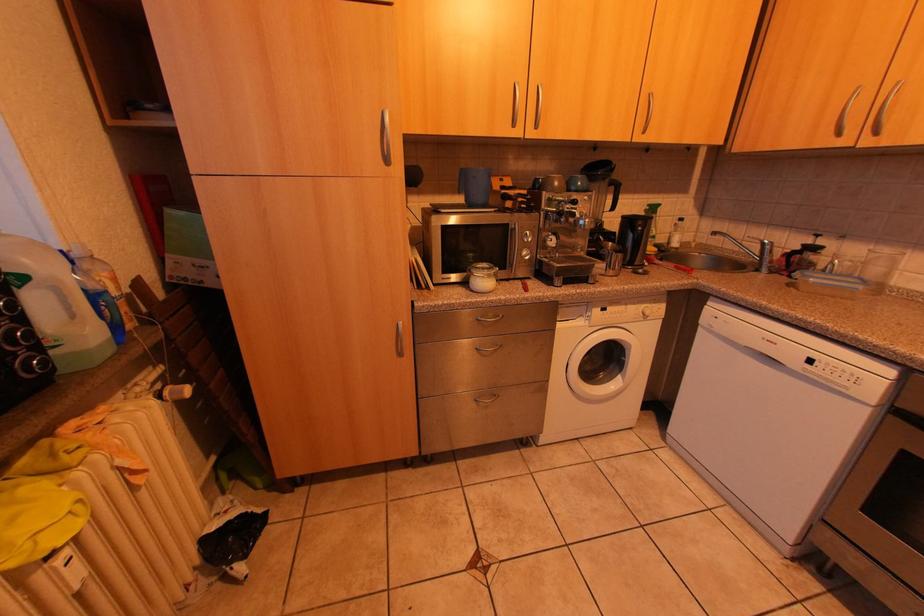
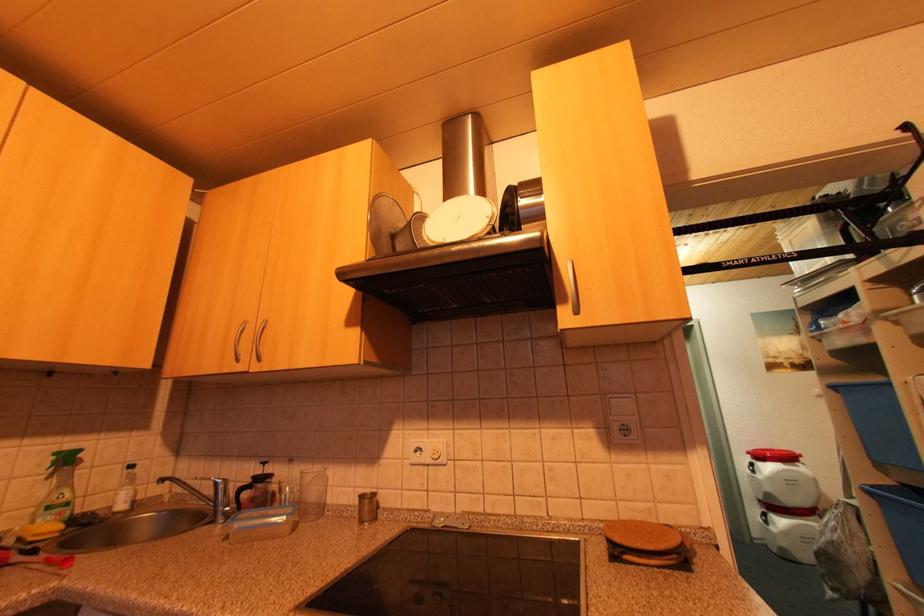
The first image is from the beginning of the video and the second image is from the end. How did the camera likely rotate when shooting the video?

The camera's rotation is toward right-up.